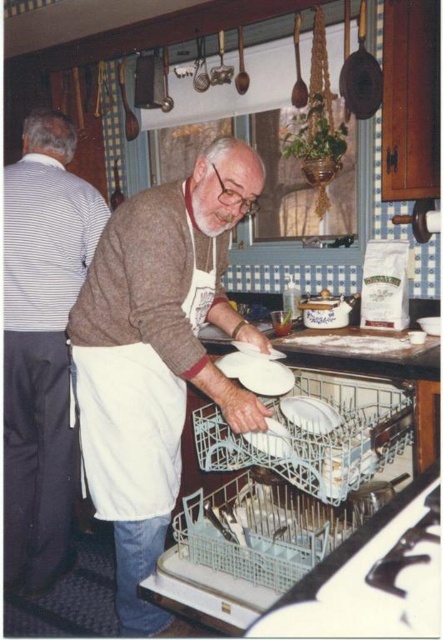
Question: Which point appears closest to the camera in this image?

Choices:
 (A) (23, 449)
 (B) (337, 416)
 (C) (353, 512)
 (D) (104, 248)

Answer: (D)

Question: Which of these objects is positioned farthest from the brown wool sweater at center?

Choices:
 (A) clear plastic dish washer at lower center
 (B) white glossy platter at center

Answer: (B)

Question: Is brown wool sweater at center above white glossy platter at center?

Choices:
 (A) yes
 (B) no

Answer: (A)

Question: Which of these objects is positioned farthest from the clear plastic dish washer at lower center?

Choices:
 (A) white glossy platter at center
 (B) brown wool sweater at center

Answer: (B)

Question: Does clear plastic dish washer at lower center have a lesser width compared to white glossy platter at center?

Choices:
 (A) no
 (B) yes

Answer: (A)

Question: Is clear plastic dish washer at lower center in front of white glossy platter at center?

Choices:
 (A) yes
 (B) no

Answer: (A)